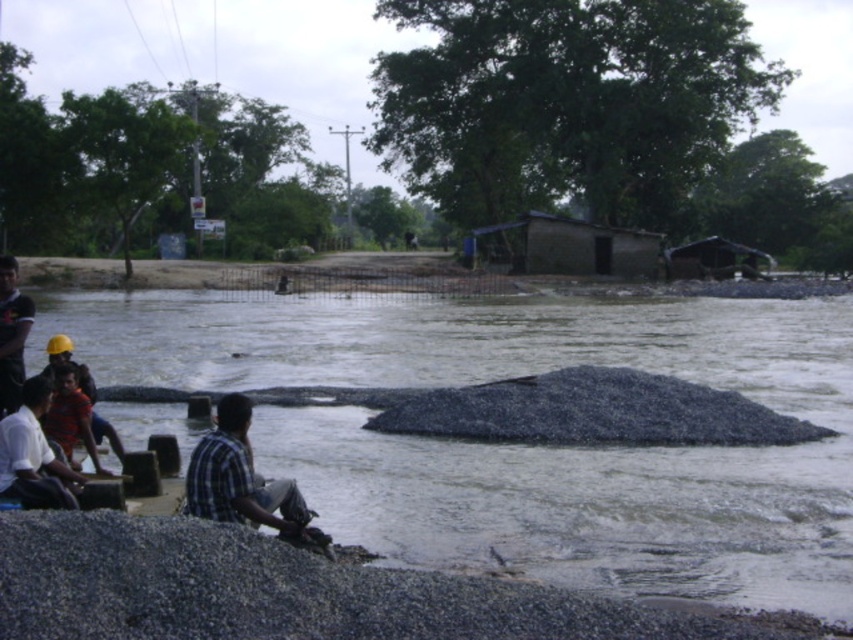
You are a photographer trying to capture a photo of the plaid shirt at lower left and the brown corrugated metal hut at center right in the scene. Based on their heights, which object should you focus on first if you want to ensure both are in the frame without moving the camera?

The plaid shirt at lower left has a lesser height compared to the brown corrugated metal hut at center right, so you should focus on the plaid shirt at lower left first to ensure it is in the frame, as it is shorter and might be obscured by the taller hut if not properly framed.

You are a construction worker standing on the gray gravel river at center. You need to reach the dark blue plaid shirt at left for a tool. Can you walk directly to them without crossing the river?

The gray gravel river at center might be wider than dark blue plaid shirt at left, so it is uncertain if you can walk directly to them without crossing the river. You may need to find another path or confirm the distance.

You are standing at the edge of the gravel pile and want to walk from the plaid shirt at lower left to the brown corrugated metal hut at center right. Which direction should you head to reach the hut?

The plaid shirt at lower left is closer to the viewer than the brown corrugated metal hut at center right, so you should head towards the center right direction to reach the hut.